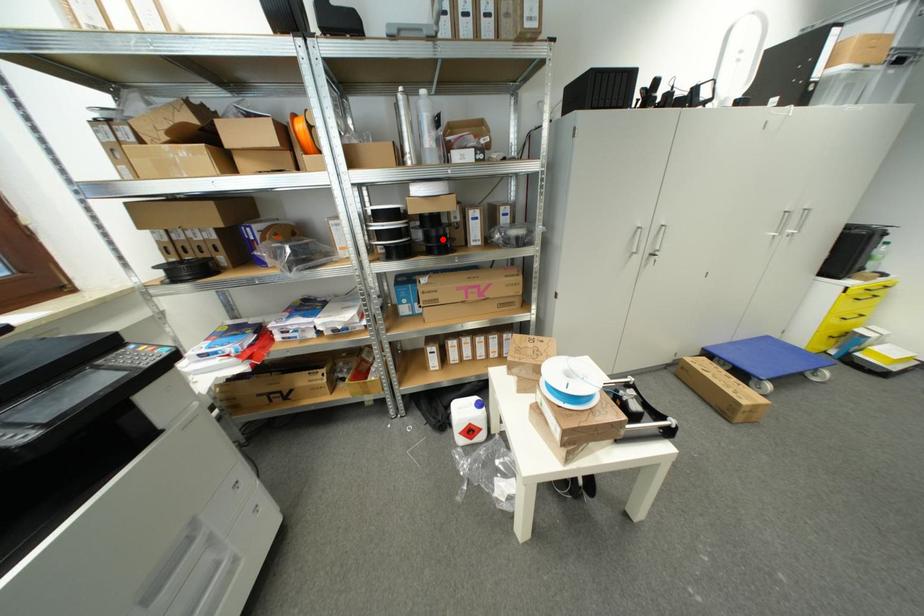
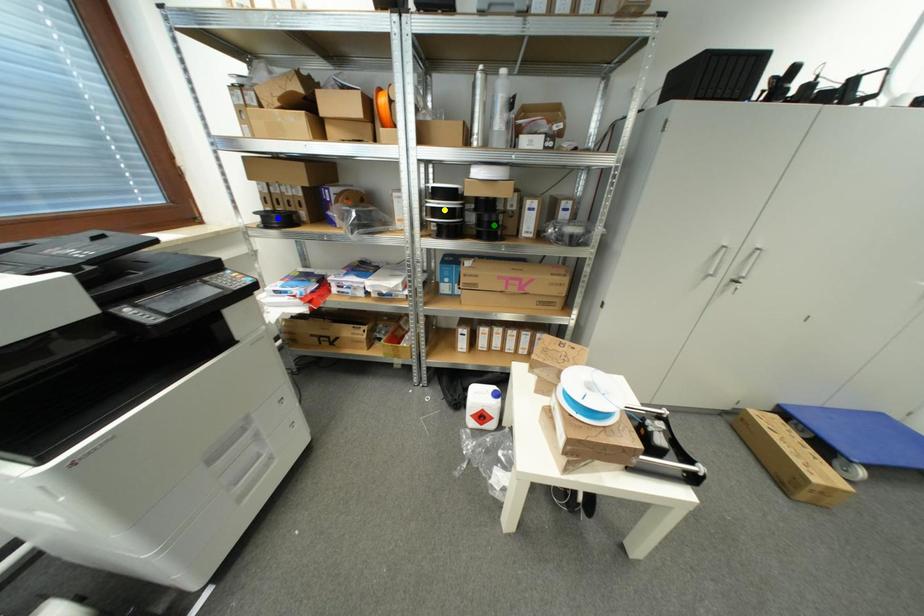
Question: I am providing you with two images of the same scene from different viewpoints. A red point is marked on the first image. You are given multiple points on the second image. Which spot in image 2 lines up with the point in image 1?

Choices:
 (A) green point
 (B) blue point
 (C) yellow point

Answer: (A)